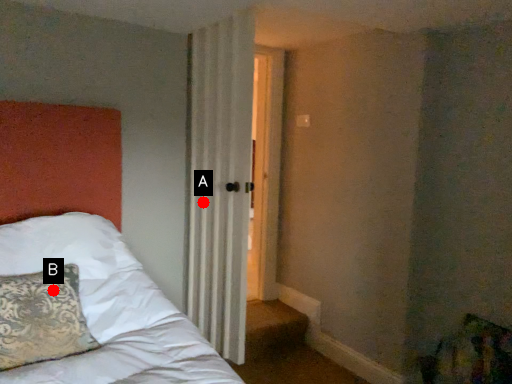
Question: Two points are circled on the image, labeled by A and B beside each circle. Which point is farther to the camera?

Choices:
 (A) A is further
 (B) B is further

Answer: (A)